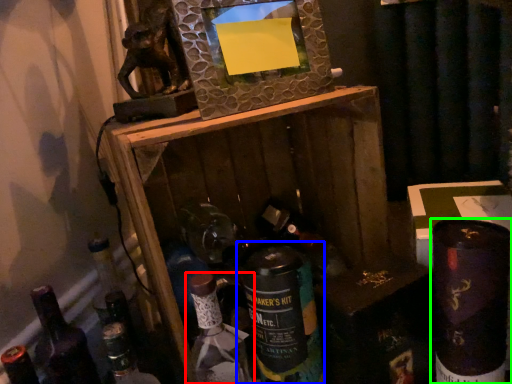
Question: Which object is the farthest from bottle (highlighted by a red box)? Choose among these: bottle (highlighted by a blue box) or bottle (highlighted by a green box).

Choices:
 (A) bottle
 (B) bottle

Answer: (B)